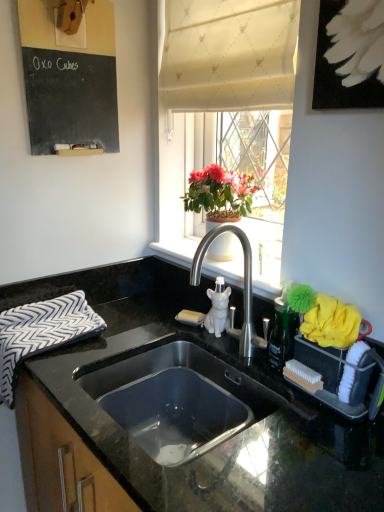
Locate an element on the screen. free spot above black granite countertop at center (from a real-world perspective) is located at coordinates (213, 338).